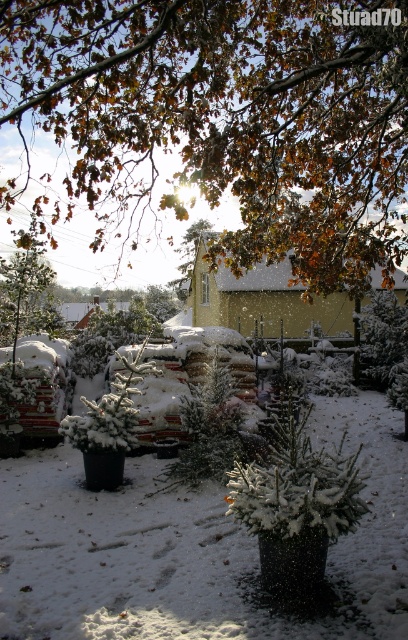
Is brown leafy tree at upper center thinner than green textured evergreen tree at center?

No.

In order to click on brown leafy tree at upper center in this screenshot , I will do `click(226, 120)`.

Find the location of a particular element. The image size is (408, 640). brown leafy tree at upper center is located at coordinates (226, 120).

Between point (26, 248) and point (190, 266), which one is positioned in front?

Point (26, 248)

Is green matte tree at upper left positioned in front of green matte tree at center?

Yes, green matte tree at upper left is in front of green matte tree at center.

At what (x,y) coordinates should I click in order to perform the action: click on green matte tree at upper left. Please return your answer as a coordinate pair (x, y). Image resolution: width=408 pixels, height=640 pixels. Looking at the image, I should click on (26, 291).

Does point (308, 132) come in front of point (181, 275)?

Yes.

Looking at this image, which is more to the right, brown leafy tree at upper center or green matte tree at center?

Positioned to the right is brown leafy tree at upper center.

Where is `brown leafy tree at upper center`? This screenshot has width=408, height=640. brown leafy tree at upper center is located at coordinates (226, 120).